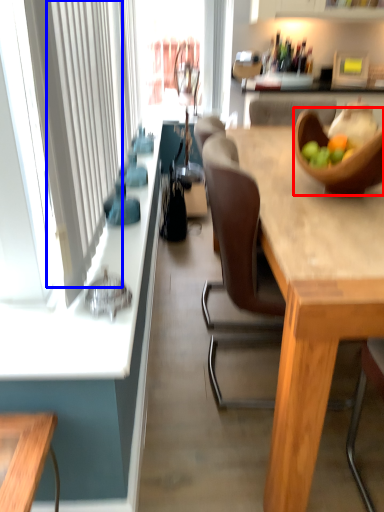
Question: Which object is further to the camera taking this photo, bowl (highlighted by a red box) or curtain (highlighted by a blue box)?

Choices:
 (A) bowl
 (B) curtain

Answer: (A)